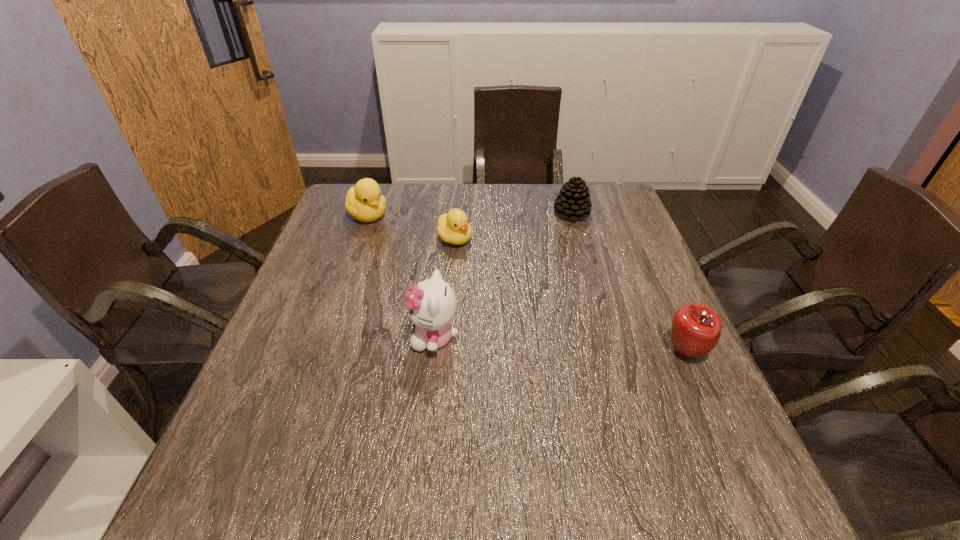
I want to click on pinecone present at the far edge, so pos(573,201).

Locate an element on the screen. The width and height of the screenshot is (960, 540). object located at the left edge is located at coordinates (364, 202).

What are the coordinates of `apple located in the right edge section of the desktop` in the screenshot? It's located at (696, 328).

At what (x,y) coordinates should I click in order to perform the action: click on pinecone located in the right edge section of the desktop. Please return your answer as a coordinate pair (x, y). This screenshot has width=960, height=540. Looking at the image, I should click on (573, 201).

You are a GUI agent. You are given a task and a screenshot of the screen. Output one action in this format:
    pyautogui.click(x=<x>, y=<y>)
    Task: Click on the object that is positioned at the far left corner
    
    Given the screenshot: What is the action you would take?
    pyautogui.click(x=364, y=202)

The height and width of the screenshot is (540, 960). In order to click on object present at the far right corner in this screenshot , I will do `click(573, 201)`.

Locate an element on the screen. The height and width of the screenshot is (540, 960). vacant space at the far edge of the desktop is located at coordinates (558, 196).

You are a GUI agent. You are given a task and a screenshot of the screen. Output one action in this format:
    pyautogui.click(x=<x>, y=<y>)
    Task: Click on the free region at the near edge of the desktop
    This screenshot has width=960, height=540.
    Given the screenshot: What is the action you would take?
    pyautogui.click(x=576, y=434)

I want to click on vacant space at the left edge of the desktop, so click(350, 313).

At what (x,y) coordinates should I click in order to perform the action: click on vacant space at the right edge of the desktop. Please return your answer as a coordinate pair (x, y). Looking at the image, I should click on (672, 396).